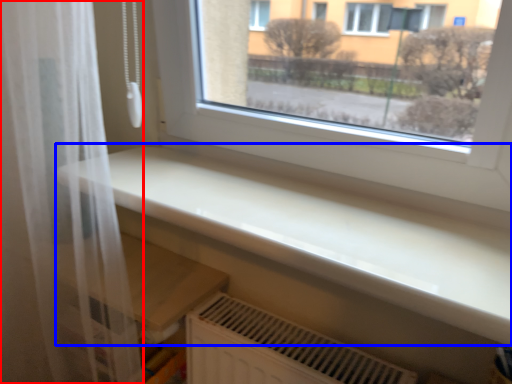
Question: Which object appears closest to the camera in this image, shower curtain (highlighted by a red box) or counter top (highlighted by a blue box)?

Choices:
 (A) shower curtain
 (B) counter top

Answer: (B)